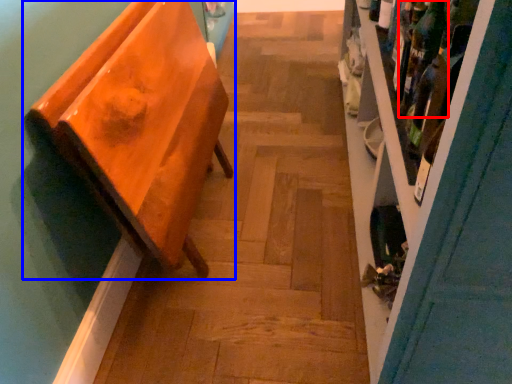
Question: Which object appears farthest to the camera in this image, wine bottle (highlighted by a red box) or furniture (highlighted by a blue box)?

Choices:
 (A) wine bottle
 (B) furniture

Answer: (A)